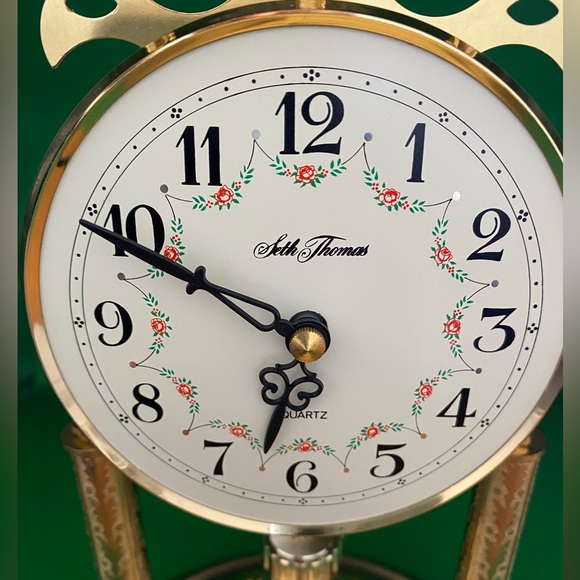
Identify the location of golden clock border. This screenshot has width=580, height=580. (238, 30).